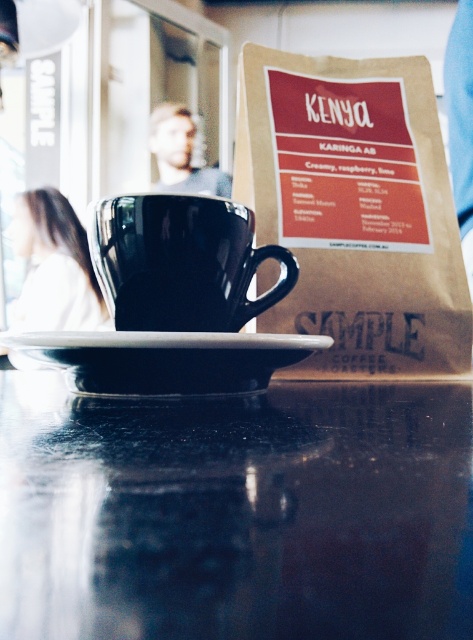
Can you confirm if glossy black table at center is taller than brown paper bag at upper right?

No.

Is glossy black table at center bigger than brown paper bag at upper right?

No.

Locate an element on the screen. The height and width of the screenshot is (640, 473). glossy black table at center is located at coordinates coord(236,513).

Does glossy black table at center appear over white glossy saucer at center?

No.

Who is more distant from viewer, (x=145, y=596) or (x=208, y=381)?

The point (x=208, y=381) is behind.

Where is `glossy black table at center`? glossy black table at center is located at coordinates (236, 513).

Is matte black mug at center closer to the viewer compared to white glossy saucer at center?

That is False.

Between matte black mug at center and white glossy saucer at center, which one appears on the right side from the viewer's perspective?

Positioned to the right is white glossy saucer at center.

Is point (292, 285) farther from viewer compared to point (215, 353)?

Yes.

Where is `matte black mug at center`? matte black mug at center is located at coordinates (181, 262).